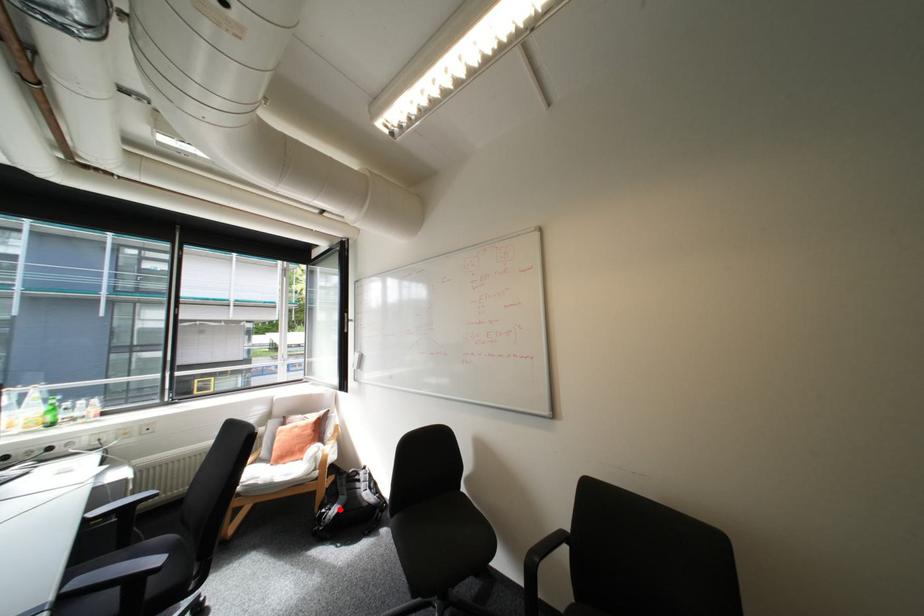
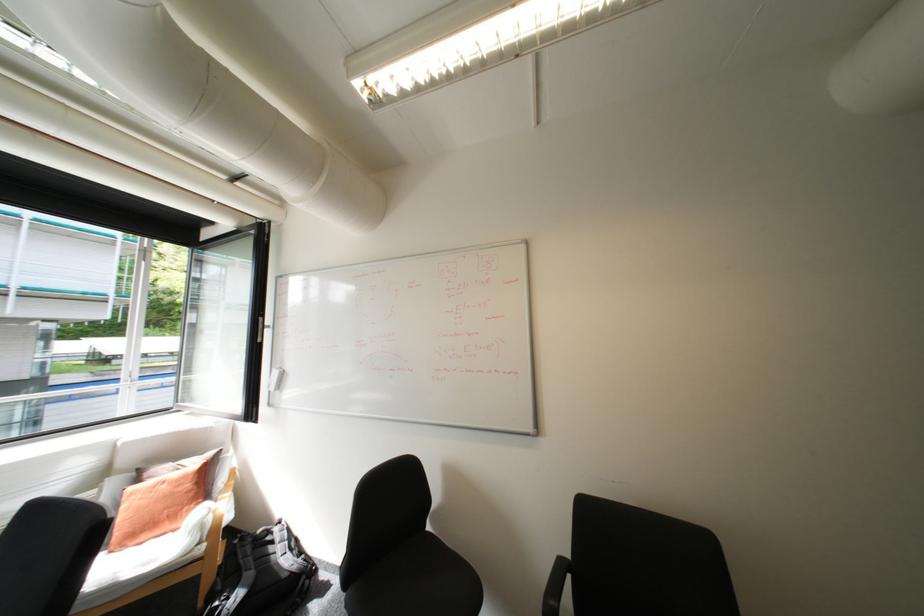
Question: I am providing you with two images of the same scene from different viewpoints. Given a red point in image1, look at the same physical point in image2. Is it:

Choices:
 (A) Closer to the viewpoint
 (B) Farther from the viewpoint

Answer: (A)